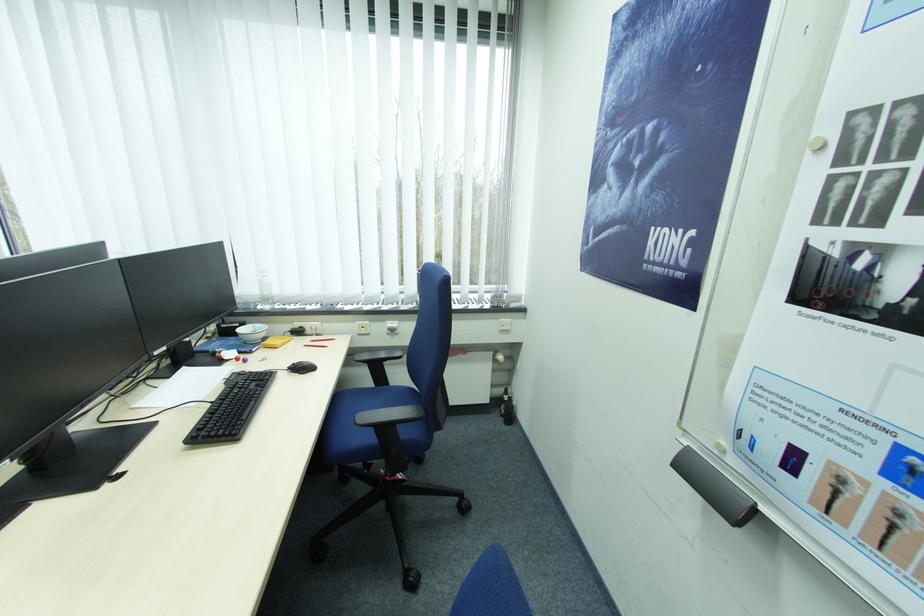
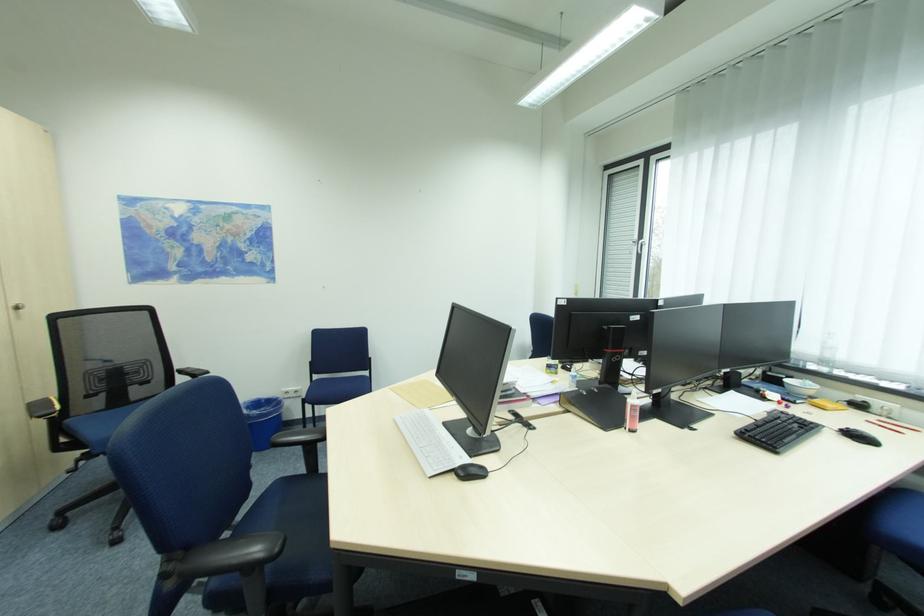
Question: How did the camera likely rotate?

Choices:
 (A) Left
 (B) Right
 (C) Up
 (D) Down

Answer: (A)